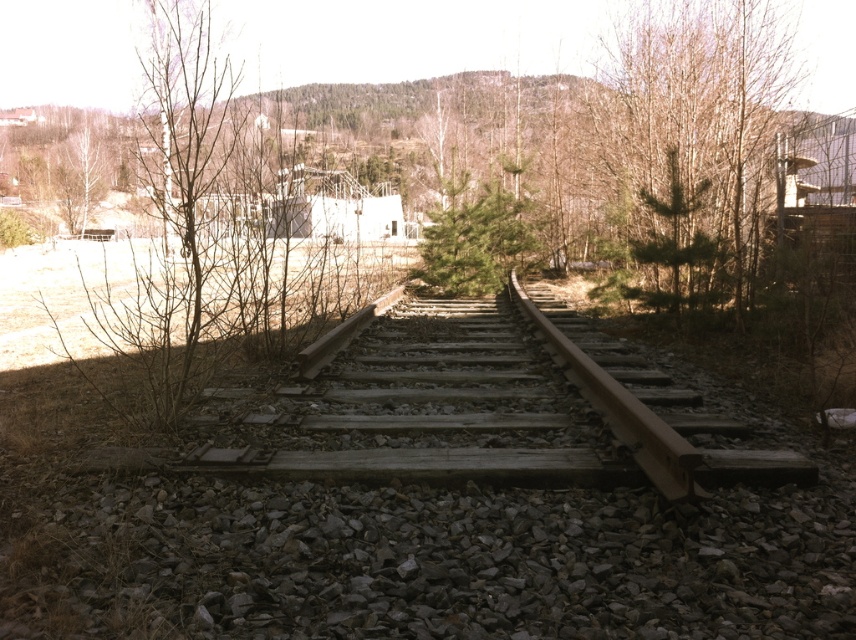
You are a railway inspector checking the tracks. You notice the bare branches at left and the green matte tree at center. Which object is positioned higher in the image?

The bare branches at left is located above the green matte tree at center, so it is positioned higher in the image.

You are a photographer wanting to capture both the bare branches at left and the green leafy tree at upper right in a single frame. Considering their sizes, which object would appear more prominent in the photo?

The bare branches at left would appear more prominent in the photo since their width is larger than that of the green leafy tree at upper right.